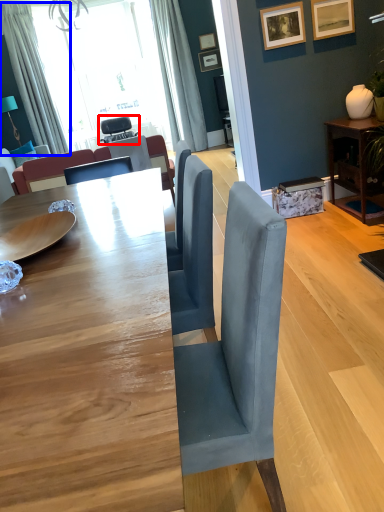
Question: Which object appears farthest to the camera in this image, chair (highlighted by a red box) or curtain (highlighted by a blue box)?

Choices:
 (A) chair
 (B) curtain

Answer: (A)